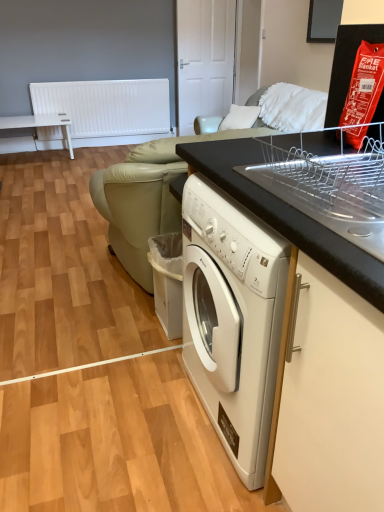
The height and width of the screenshot is (512, 384). I want to click on black granite countertop at center, so click(318, 350).

Measure the distance between black granite countertop at center and camera.

A distance of 24.83 inches exists between black granite countertop at center and camera.

The width and height of the screenshot is (384, 512). What do you see at coordinates (318, 350) in the screenshot? I see `black granite countertop at center` at bounding box center [318, 350].

Image resolution: width=384 pixels, height=512 pixels. Find the location of `black granite countertop at center`. black granite countertop at center is located at coordinates (318, 350).